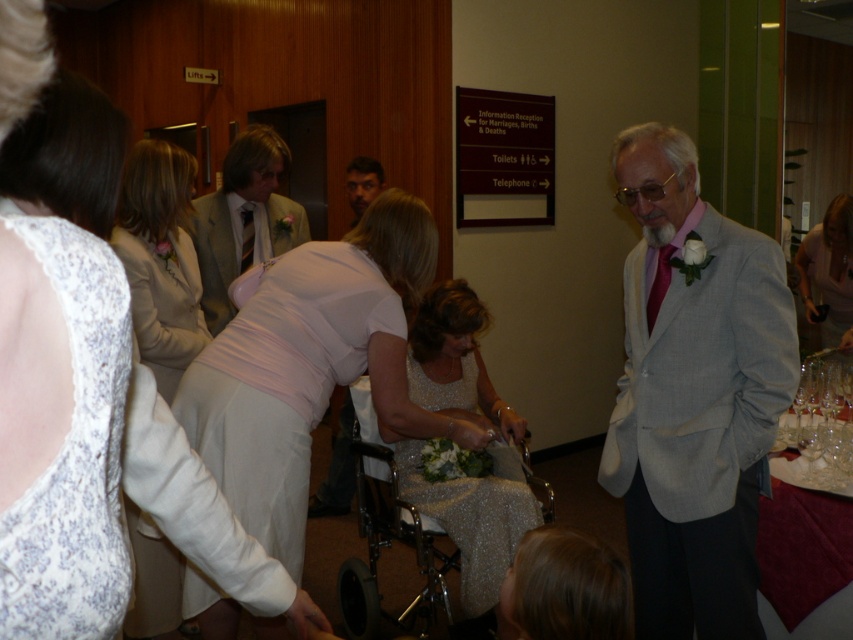
Does light gray suit at center come in front of dark brown hair at center?

That is True.

Between point (239, 141) and point (358, 172), which one is positioned in front?

Positioned in front is point (239, 141).

Where is `light gray suit at center`? This screenshot has height=640, width=853. light gray suit at center is located at coordinates (242, 218).

Is beige fabric suit at left above light gray suit at center?

Actually, beige fabric suit at left is below light gray suit at center.

Can you confirm if beige fabric suit at left is shorter than light gray suit at center?

Correct, beige fabric suit at left is not as tall as light gray suit at center.

The image size is (853, 640). What are the coordinates of `beige fabric suit at left` in the screenshot? It's located at (160, 259).

This screenshot has height=640, width=853. I want to click on beige fabric suit at left, so click(x=160, y=259).

Does matte white dress at center have a greater width compared to white lace dress at center?

Indeed, matte white dress at center has a greater width compared to white lace dress at center.

Is point (236, 483) closer to viewer compared to point (83, 285)?

That is False.

Where is `matte white dress at center`? matte white dress at center is located at coordinates (312, 364).